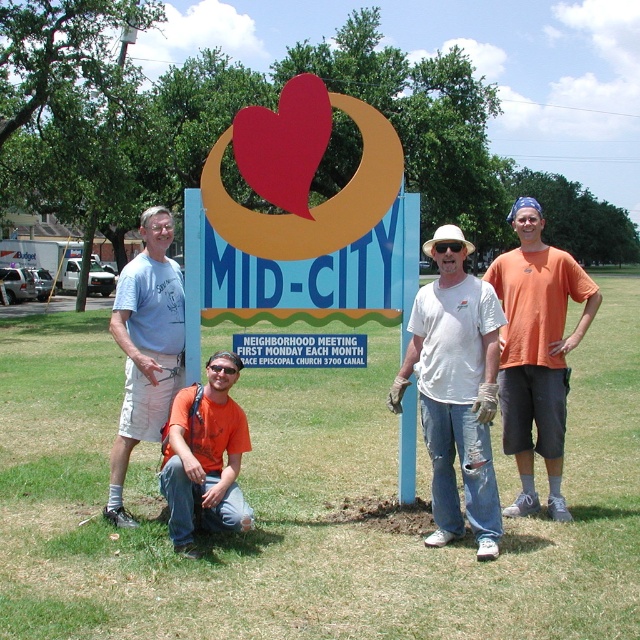
Question: Does white cotton shirt at center have a smaller size compared to matte blue shirt at left?

Choices:
 (A) no
 (B) yes

Answer: (B)

Question: Which object appears closest to the camera in this image?

Choices:
 (A) orange t-shirt at center
 (B) white cotton shirt at center
 (C) matte blue shirt at left
 (D) orange cotton shirt at right

Answer: (A)

Question: Is white cotton shirt at center further to the viewer compared to orange t-shirt at center?

Choices:
 (A) no
 (B) yes

Answer: (B)

Question: Based on their relative distances, which object is farther from the white cotton shirt at center?

Choices:
 (A) orange cotton shirt at right
 (B) orange t-shirt at center

Answer: (B)

Question: Is white cotton shirt at center thinner than orange t-shirt at center?

Choices:
 (A) no
 (B) yes

Answer: (B)

Question: Based on their relative distances, which object is farther from the matte blue shirt at left?

Choices:
 (A) orange cotton shirt at right
 (B) white cotton shirt at center

Answer: (A)